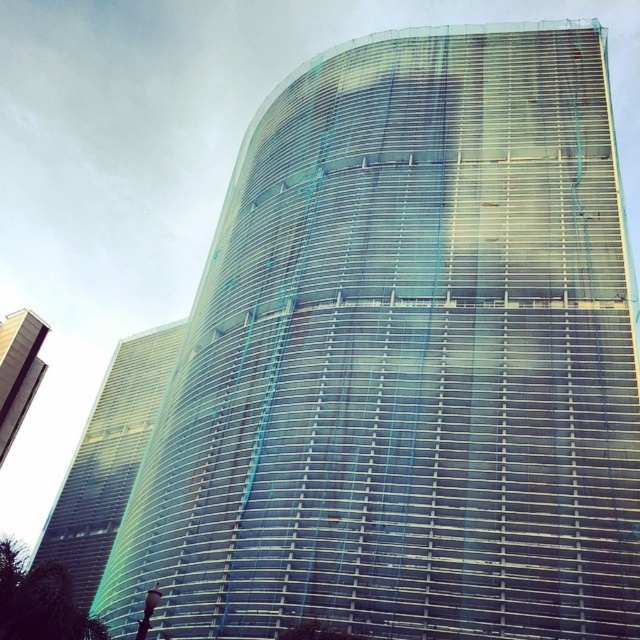
Consider the image. Is transparent glass building at center positioned in front of clear glass building at upper left?

Yes, transparent glass building at center is in front of clear glass building at upper left.

Who is positioned more to the left, transparent glass building at center or clear glass building at upper left?

Positioned to the left is clear glass building at upper left.

Identify the location of transparent glass building at center. (108, 458).